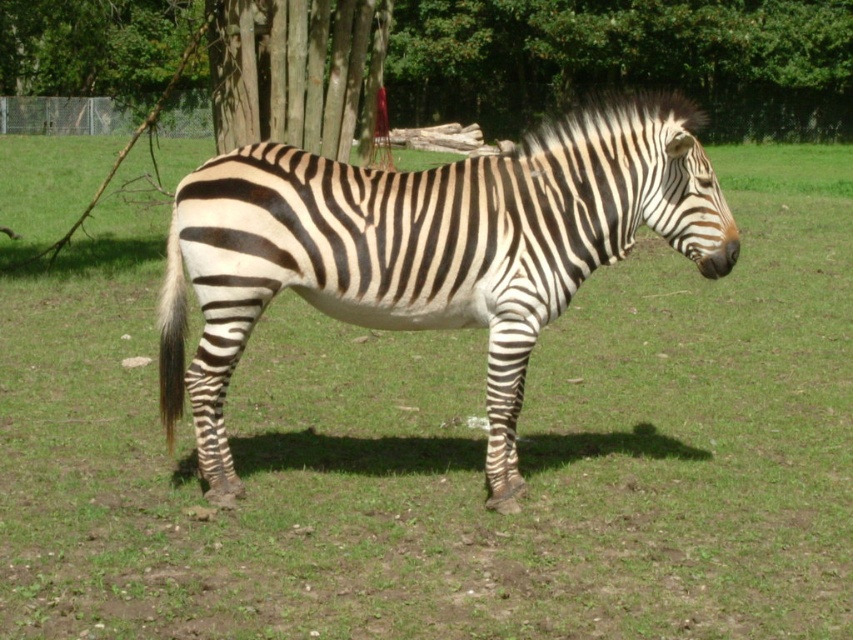
You are standing at the entrance of the enclosure and see the green leafy tree at upper center. If you want to walk directly towards it from your current position, which direction should you head?

The green leafy tree at upper center is located at point (625, 60), so you should head towards the upper center direction to reach it.

Consider the image. You are a zookeeper planning to feed the black and white striped zebra at center. The feeding station is located near the rough bark tree at upper center. If the zebra can walk 10 feet per minute, how many minutes will it take for the zebra to reach the feeding station from its current position?

The distance between the black and white striped zebra at center and the rough bark tree at upper center is 31.14 feet. Since the zebra walks at 10 feet per minute, it would take approximately 3.11 minutes to reach the feeding station.

You are a bird looking for a place to perch. You see a green leafy tree at upper center and a rough bark tree at upper center. Which tree is located above the other?

The green leafy tree at upper center is positioned over the rough bark tree at upper center.